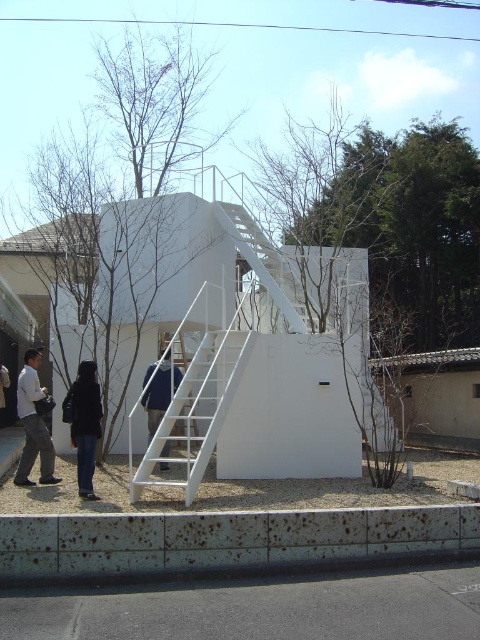
Question: Which object is positioned closest to the light brown leather jacket at lower left?

Choices:
 (A) white matte staircase at center
 (B) blue fabric jacket at center
 (C) dark blue jeans at lower center

Answer: (C)

Question: Does white matte staircase at center appear on the left side of dark blue jeans at lower center?

Choices:
 (A) no
 (B) yes

Answer: (A)

Question: Which point is farther from the camera taking this photo?

Choices:
 (A) (72, 444)
 (B) (156, 406)

Answer: (B)

Question: Does dark blue jeans at lower center have a smaller size compared to blue fabric jacket at center?

Choices:
 (A) yes
 (B) no

Answer: (A)

Question: Can you confirm if light brown leather jacket at lower left is smaller than blue fabric jacket at center?

Choices:
 (A) yes
 (B) no

Answer: (A)

Question: Which object is positioned closest to the white matte staircase at center?

Choices:
 (A) blue fabric jacket at center
 (B) light brown leather jacket at lower left

Answer: (A)